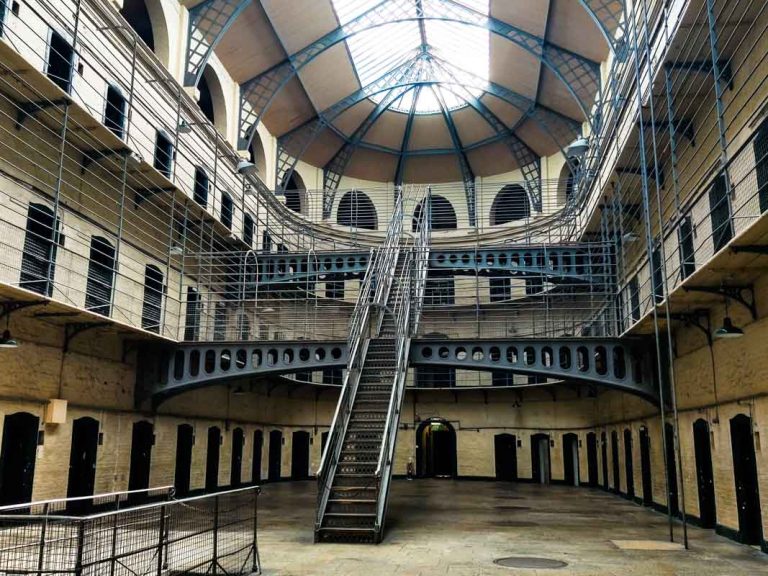
The height and width of the screenshot is (576, 768). Find the location of `chain across staircase`. chain across staircase is located at coordinates (323, 482), (343, 496), (369, 480).